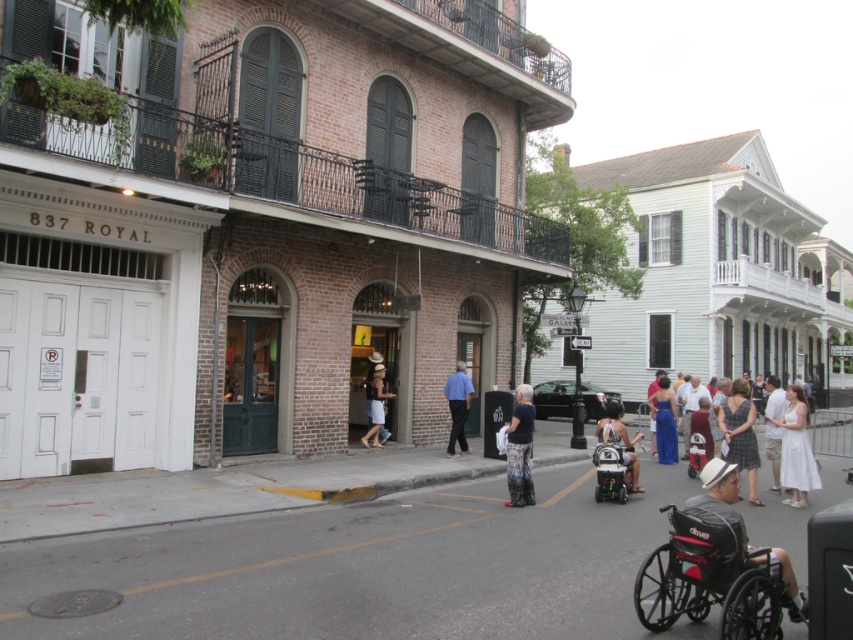
Question: Which point is closer to the camera?

Choices:
 (A) brick building at center
 (B) gray concrete sidewalk at center
 (C) white felt hat at lower right
 (D) matte white dress at center

Answer: (C)

Question: Considering the relative positions of blue satin dress at lower right and white cotton dress at center in the image provided, where is blue satin dress at lower right located with respect to white cotton dress at center?

Choices:
 (A) right
 (B) left

Answer: (B)

Question: Can you confirm if brick building at center is positioned to the left of matte white dress at center?

Choices:
 (A) yes
 (B) no

Answer: (A)

Question: Which object is positioned farthest from the white satin dress at center?

Choices:
 (A) white felt hat at lower right
 (B) denim skirt at center
 (C) dark gray dress at center

Answer: (B)

Question: Does black leather wheelchair at lower right have a lesser width compared to floral-patterned pants at center?

Choices:
 (A) no
 (B) yes

Answer: (A)

Question: Which point is closer to the camera?

Choices:
 (A) black plastic wheelchair at center
 (B) matte white dress at center
 (C) denim skirt at center
 (D) white cotton dress at center

Answer: (B)